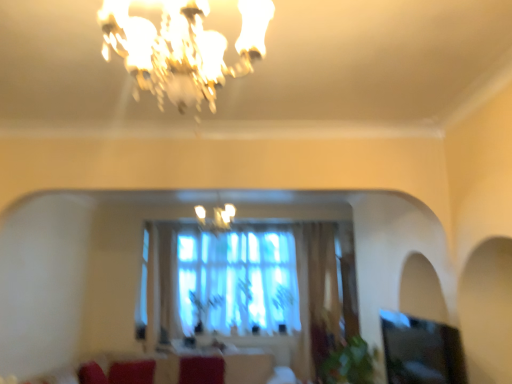
Question: From the image's perspective, is velvet red couch at lower center on wooden round table at center?

Choices:
 (A) no
 (B) yes

Answer: (A)

Question: From a real-world perspective, is velvet red couch at lower center located higher than wooden round table at center?

Choices:
 (A) yes
 (B) no

Answer: (B)

Question: Is velvet red couch at lower center not near wooden round table at center?

Choices:
 (A) yes
 (B) no

Answer: (B)

Question: Is velvet red couch at lower center shorter than wooden round table at center?

Choices:
 (A) yes
 (B) no

Answer: (B)

Question: Can we say velvet red couch at lower center lies outside wooden round table at center?

Choices:
 (A) no
 (B) yes

Answer: (B)

Question: Is the position of velvet red couch at lower center more distant than that of wooden round table at center?

Choices:
 (A) yes
 (B) no

Answer: (B)

Question: From a real-world perspective, is matte glass chandelier at center, arranged as the second lamp when viewed from the top, over transparent glass window screen at lower right?

Choices:
 (A) yes
 (B) no

Answer: (A)

Question: Does matte glass chandelier at center, positioned as the first lamp in back-to-front order, have a smaller size compared to transparent glass window screen at lower right?

Choices:
 (A) no
 (B) yes

Answer: (B)

Question: Is matte glass chandelier at center, arranged as the second lamp when viewed from the top, not within transparent glass window screen at lower right?

Choices:
 (A) no
 (B) yes

Answer: (B)

Question: Can you confirm if matte glass chandelier at center, which appears as the 2th lamp when viewed from the front, is bigger than transparent glass window screen at lower right?

Choices:
 (A) yes
 (B) no

Answer: (B)

Question: From the image's perspective, is matte glass chandelier at center, the 1th lamp in the bottom-to-top sequence, under transparent glass window screen at lower right?

Choices:
 (A) no
 (B) yes

Answer: (A)

Question: Is wooden round table at center outside velvet red couch at lower center?

Choices:
 (A) no
 (B) yes

Answer: (B)